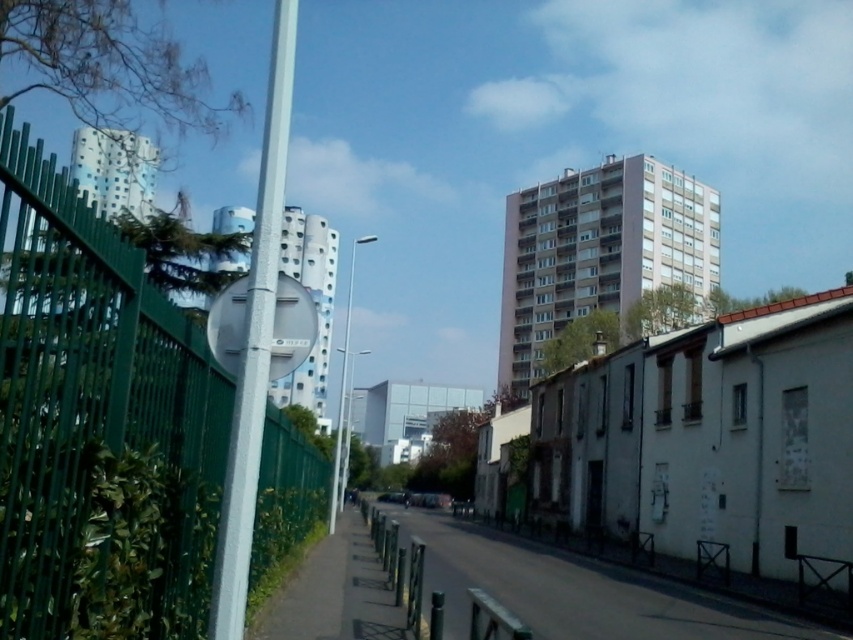
You are a city planner assessing the street layout. The metallic pole at left and the metallic pole at center are both in need of replacement. Based on their heights, which pole requires a taller replacement pole?

The metallic pole at center requires a taller replacement pole because it is taller than the metallic pole at left.

You are a delivery robot navigating an urban street. You need to deliver a package to a location behind the metallic pole at center. However, there is a green metal fence at left blocking your path. Can you go around the fence to reach the pole?

The green metal fence at left is closer to the viewer than the metallic pole at center, so you can go around the fence to reach the pole since the pole is further away and the fence is in front of it.